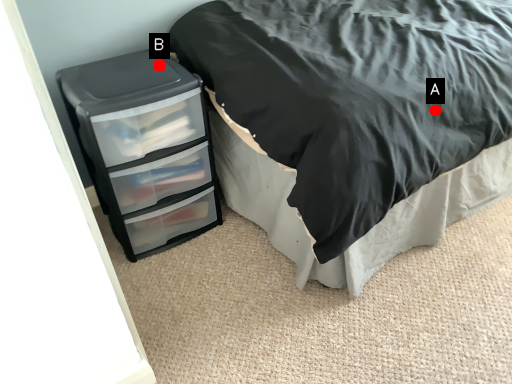
Question: Two points are circled on the image, labeled by A and B beside each circle. Which point is closer to the camera?

Choices:
 (A) A is closer
 (B) B is closer

Answer: (A)